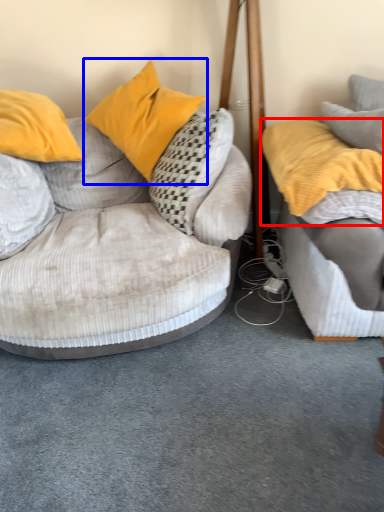
Question: Among these objects, which one is nearest to the camera, pillow (highlighted by a red box) or pillow (highlighted by a blue box)?

Choices:
 (A) pillow
 (B) pillow

Answer: (A)